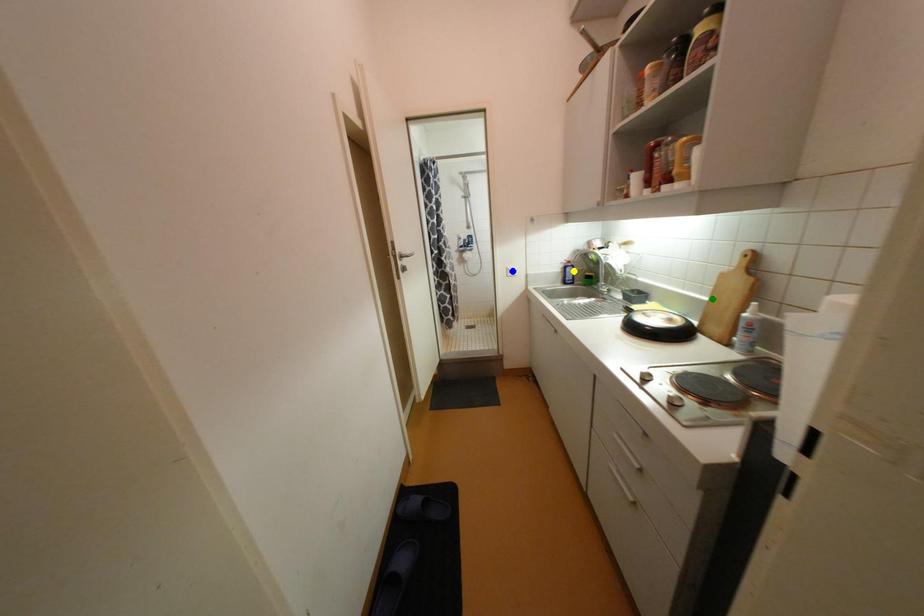
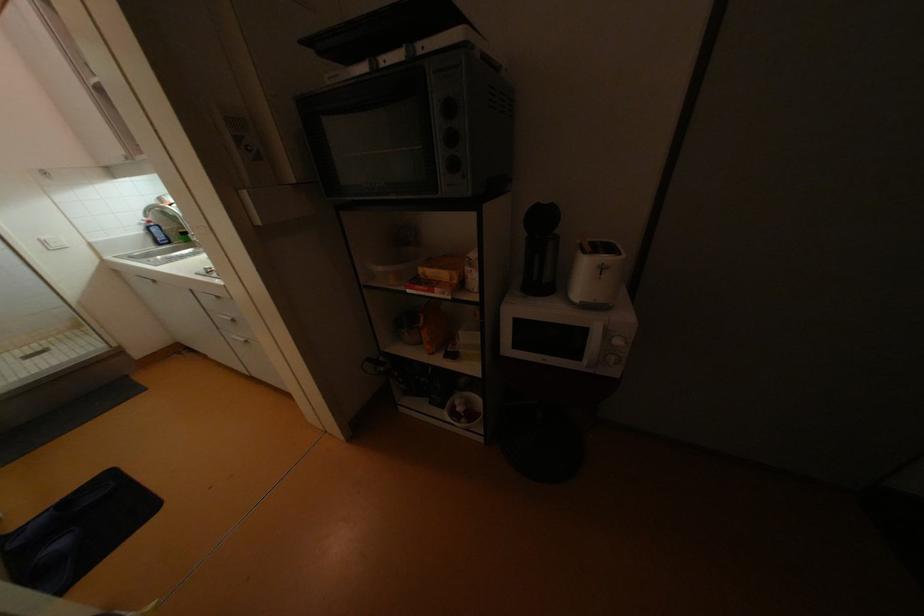
I am providing you with two images of the same scene from different viewpoints. Three points are marked in image1. Which point corresponds to a part or object that is occluded in image2?In image1, three points are marked. Which of them correspond to a part or object that is occluded in image2?Among the three points shown in image1, which one corresponds to a part or object that is no longer visible due to occlusion in image2?

green point cannot be seen in image2.